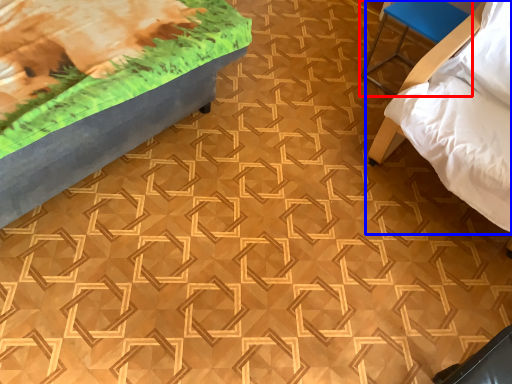
Question: Which of the following is the closest to the observer, furniture (highlighted by a red box) or furniture (highlighted by a blue box)?

Choices:
 (A) furniture
 (B) furniture

Answer: (B)